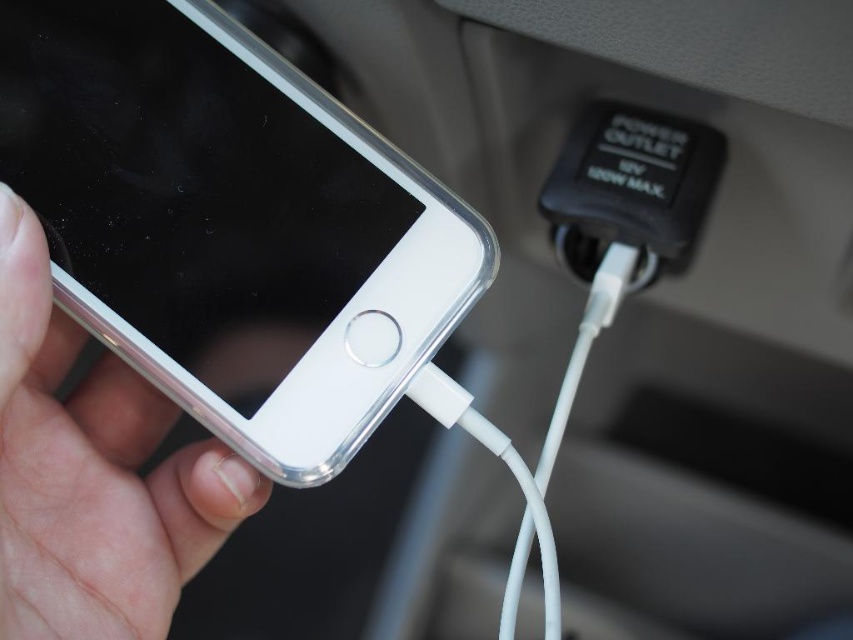
Question: Is clear plastic smartphone at left below silver metallic phone at lower left?

Choices:
 (A) yes
 (B) no

Answer: (B)

Question: Is clear plastic smartphone at left wider than silver metallic phone at lower left?

Choices:
 (A) yes
 (B) no

Answer: (A)

Question: Which of the following is the closest to the observer?

Choices:
 (A) (13, 406)
 (B) (326, 196)

Answer: (A)

Question: Which point is closer to the camera?

Choices:
 (A) clear plastic smartphone at left
 (B) silver metallic phone at lower left

Answer: (B)

Question: Which of the following is the closest to the observer?

Choices:
 (A) clear plastic smartphone at left
 (B) silver metallic phone at lower left

Answer: (B)

Question: Is clear plastic smartphone at left to the right of silver metallic phone at lower left from the viewer's perspective?

Choices:
 (A) no
 (B) yes

Answer: (B)